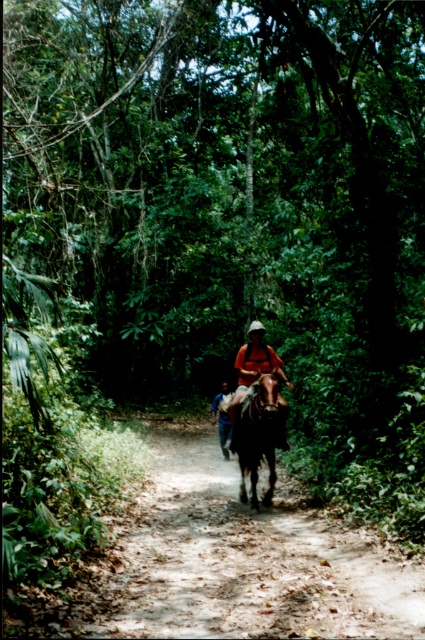
Question: Which point is farther to the camera?

Choices:
 (A) dirt path at center
 (B) brown glossy horse at center
 (C) orange fabric shirt at center

Answer: (C)

Question: Does dirt path at center appear under brown glossy horse at center?

Choices:
 (A) yes
 (B) no

Answer: (A)

Question: Can you confirm if orange fabric shirt at center is bigger than blue cotton shirt at center?

Choices:
 (A) no
 (B) yes

Answer: (B)

Question: Which object appears farthest from the camera in this image?

Choices:
 (A) orange fabric shirt at center
 (B) brown glossy horse at center
 (C) dirt path at center
 (D) blue cotton shirt at center

Answer: (D)

Question: Among these objects, which one is nearest to the camera?

Choices:
 (A) orange fabric shirt at center
 (B) dirt path at center
 (C) brown glossy horse at center
 (D) blue cotton shirt at center

Answer: (B)

Question: Is brown glossy horse at center bigger than blue cotton shirt at center?

Choices:
 (A) yes
 (B) no

Answer: (B)